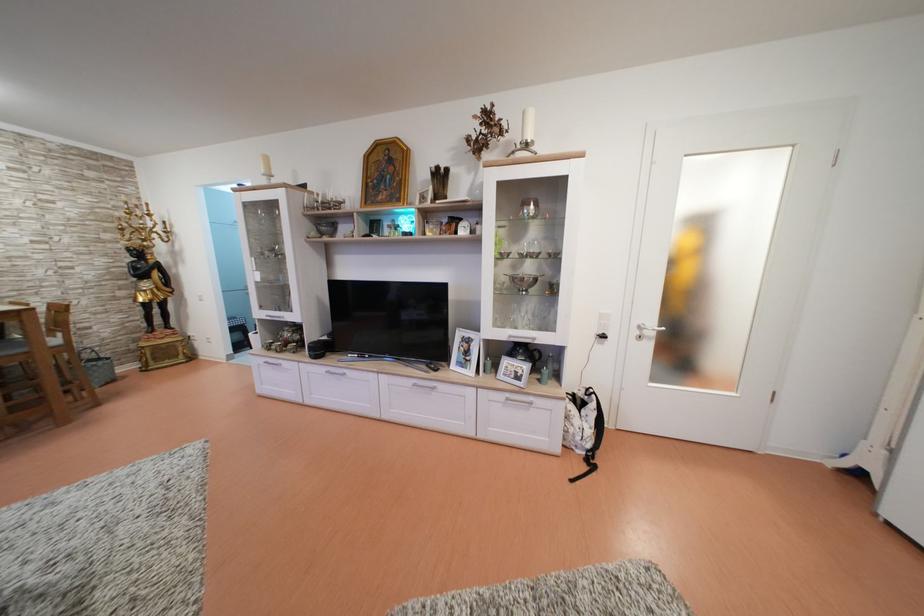
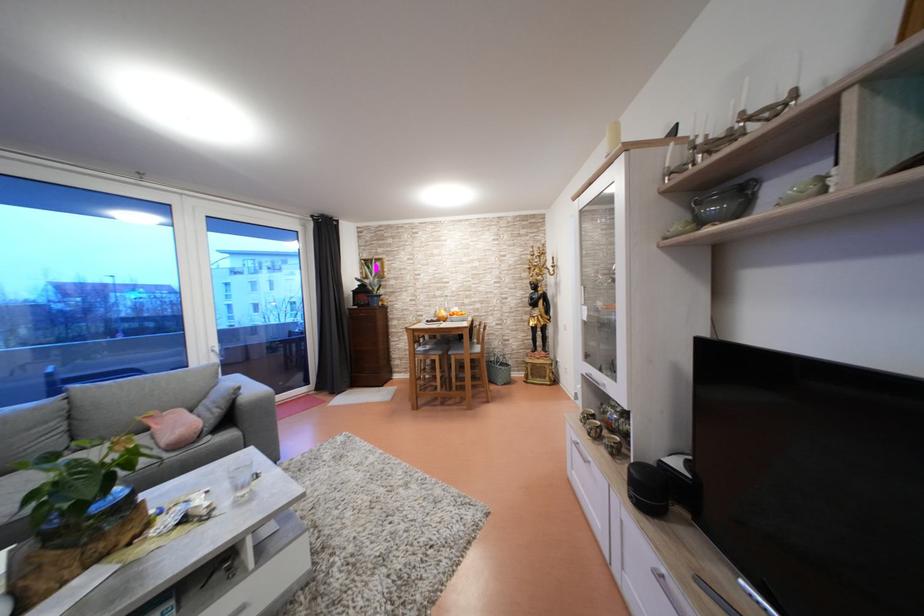
The point at (107, 368) is marked in the first image. Where is the corresponding point in the second image?

(511, 373)